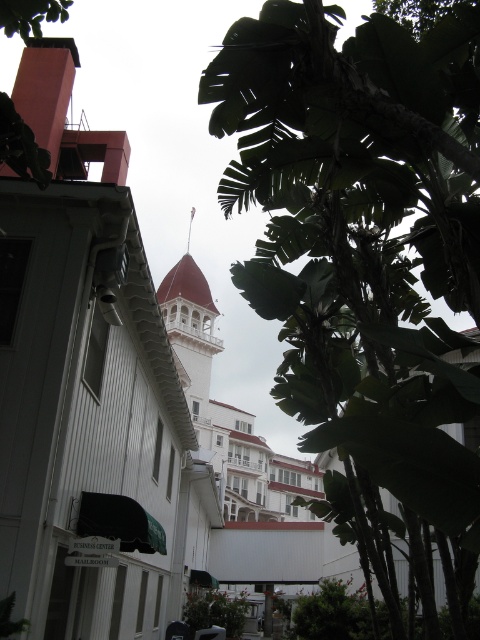
In the scene shown: You are standing in front of the large building and notice two green leafy plants. The green leafy tree at center and the green leafy plant at lower center. Which one is positioned higher up in the image?

The green leafy tree at center is located above the green leafy plant at lower center, so it is positioned higher up in the image.

You are standing at the point marked as point (216, 611) in the image. What object is located exactly at your current position?

The green leafy plant at lower center is located exactly at point (216, 611).

You are standing in front of the large building with the red conical roof and want to take a photo. There are two points marked on the building facade at coordinates point (365, 278) and point (197, 593). Which point will appear larger in your camera view?

Point (365, 278) is closer to the camera than point (197, 593). Since objects closer to the camera appear larger in the photo, point (365, 278) will appear larger in the camera view.